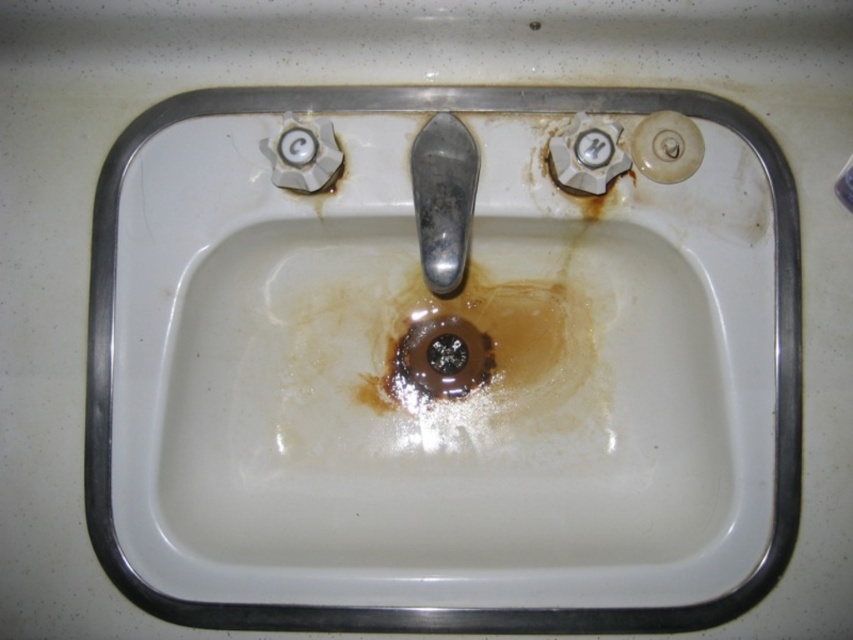
Which is in front, point (430, 124) or point (456, 346)?

Point (430, 124) is in front.

Is point (457, 204) in front of point (397, 364)?

Yes, point (457, 204) is closer to viewer.

The width and height of the screenshot is (853, 640). What do you see at coordinates (444, 198) in the screenshot?
I see `shiny metallic faucet at center` at bounding box center [444, 198].

This screenshot has height=640, width=853. Find the location of `shiny metallic faucet at center`. shiny metallic faucet at center is located at coordinates (444, 198).

Can you confirm if white porcelain sink at center is positioned to the left of brown matte drain at center?

No, white porcelain sink at center is not to the left of brown matte drain at center.

Who is lower down, white porcelain sink at center or brown matte drain at center?

brown matte drain at center

Locate an element on the screen. white porcelain sink at center is located at coordinates point(444,609).

Identify the location of white porcelain sink at center. coord(444,609).

Who is more forward, (606, 97) or (415, 166)?

Positioned in front is point (415, 166).

Find the location of a particular element. The width and height of the screenshot is (853, 640). white porcelain sink at center is located at coordinates (444, 609).

Is point (793, 429) farther from viewer compared to point (453, 198)?

Yes, it is.

Where is `white porcelain sink at center`? The height and width of the screenshot is (640, 853). white porcelain sink at center is located at coordinates (444, 609).